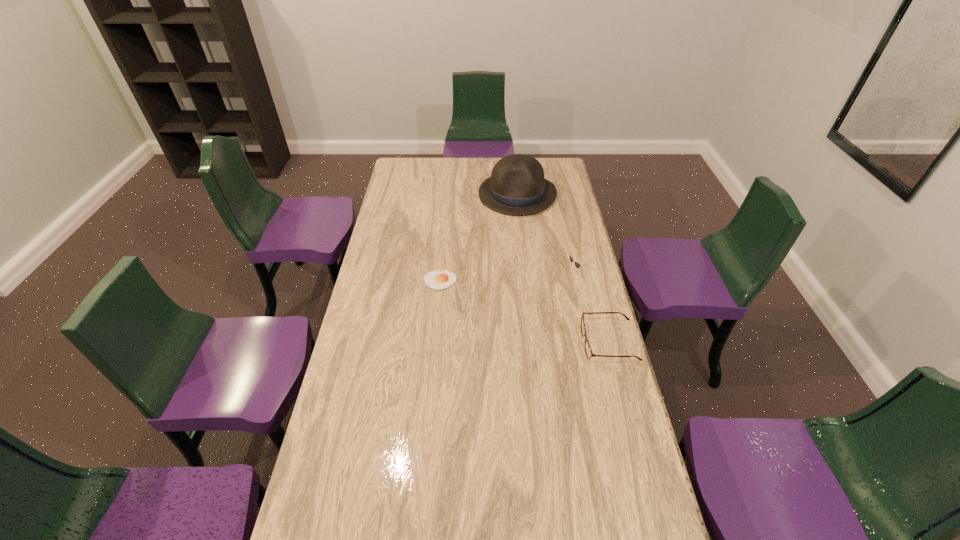
Locate an element on the screen. The image size is (960, 540). free space on the desktop that is between the shortest object and the third tallest object and is positioned in front of the lenses of the second tallest object is located at coordinates (502, 303).

Where is `vacant spot on the desktop that is between the leftmost object and the nearest object and is positioned on the front-facing side of the tallest object`? vacant spot on the desktop that is between the leftmost object and the nearest object and is positioned on the front-facing side of the tallest object is located at coordinates (522, 310).